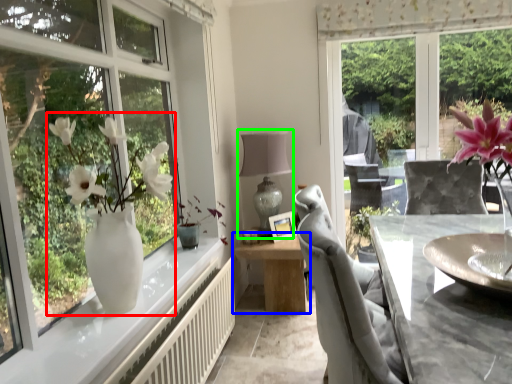
Question: Which is farther away from floral arrangement (highlighted by a red box)? table (highlighted by a blue box) or table lamp (highlighted by a green box)?

Choices:
 (A) table
 (B) table lamp

Answer: (A)